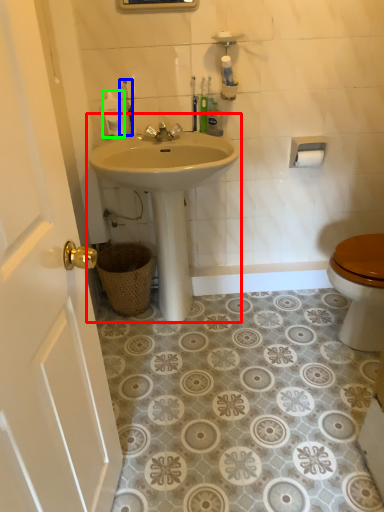
Question: Based on their relative distances, which object is farther from sink (highlighted by a red box)? Choose from toiletry (highlighted by a blue box) and toiletry (highlighted by a green box).

Choices:
 (A) toiletry
 (B) toiletry

Answer: (A)